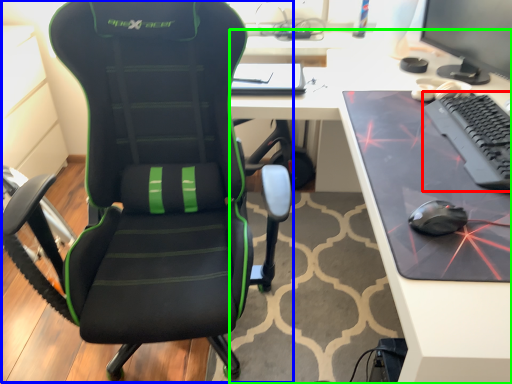
Question: Which is nearer to the computer keyboard (highlighted by a red box)? chair (highlighted by a blue box) or desk (highlighted by a green box).

Choices:
 (A) chair
 (B) desk

Answer: (B)